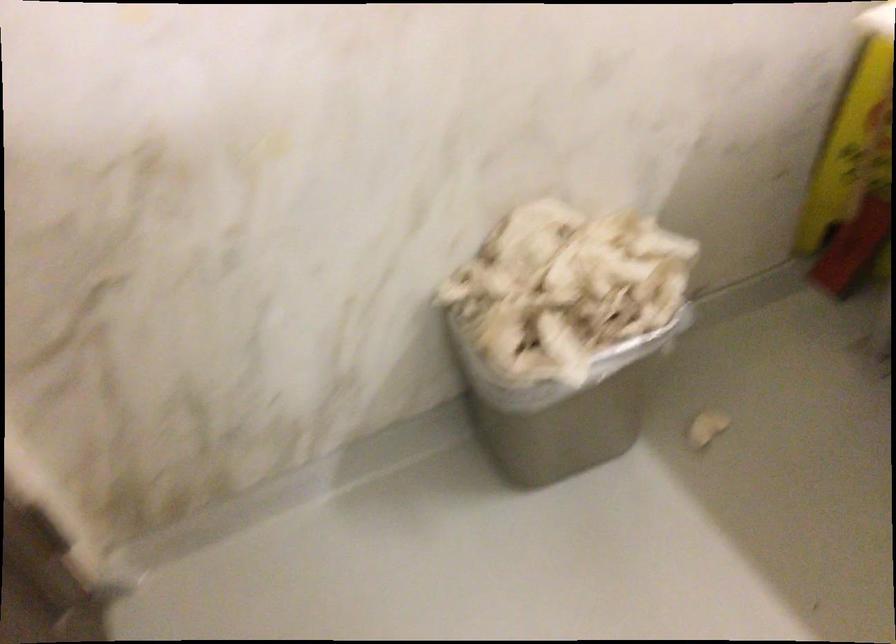
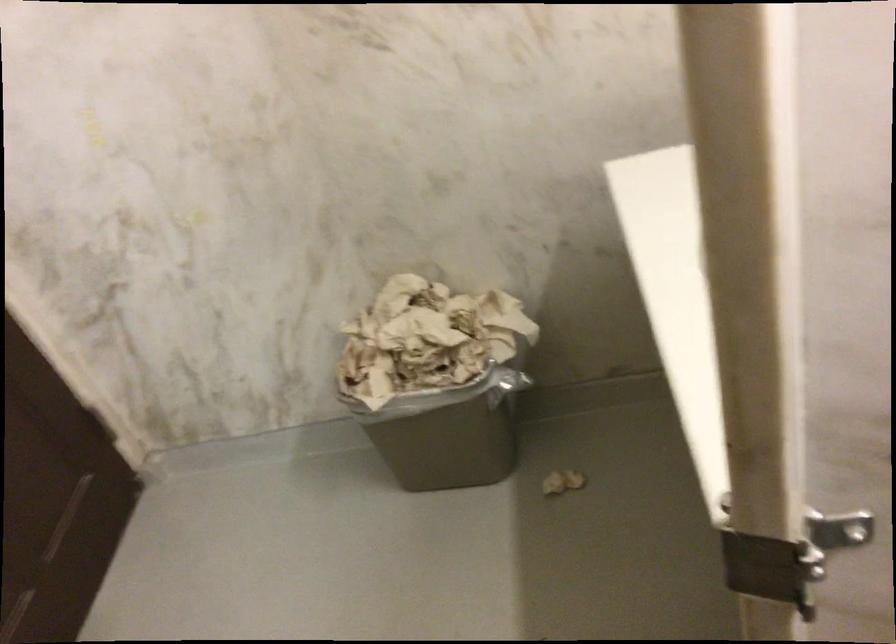
Question: Which direction would the cameraman need to move to produce the second image? Reply with the corresponding letter.

Choices:
 (A) Left
 (B) Right
 (C) Forward
 (D) Backward

Answer: (B)